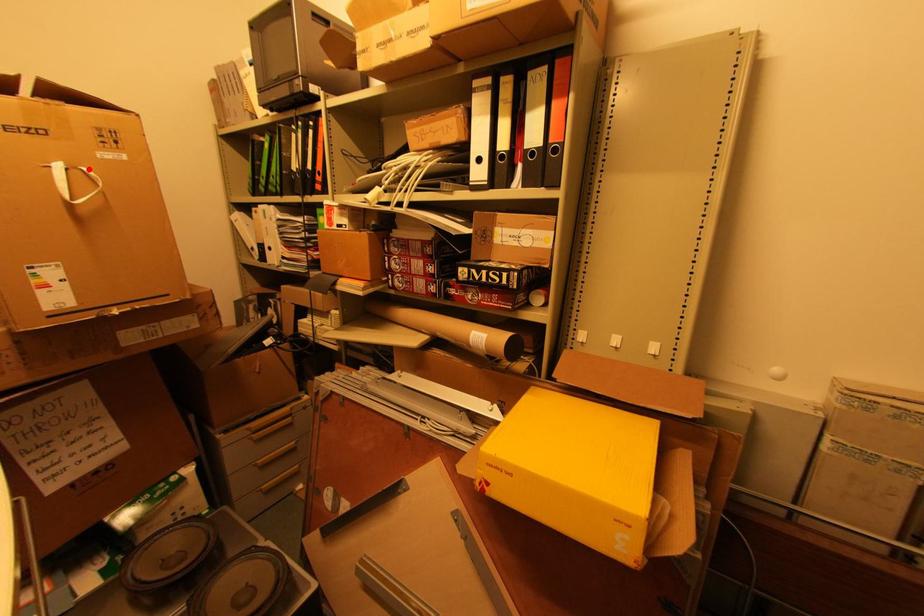
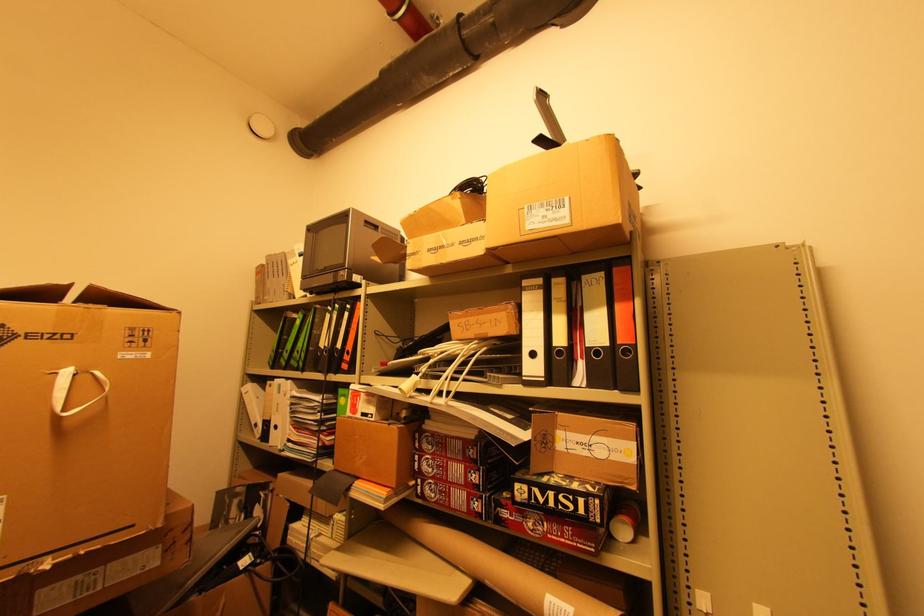
The point at the highlighted location is marked in the first image. Where is the corresponding point in the second image?

(101, 373)